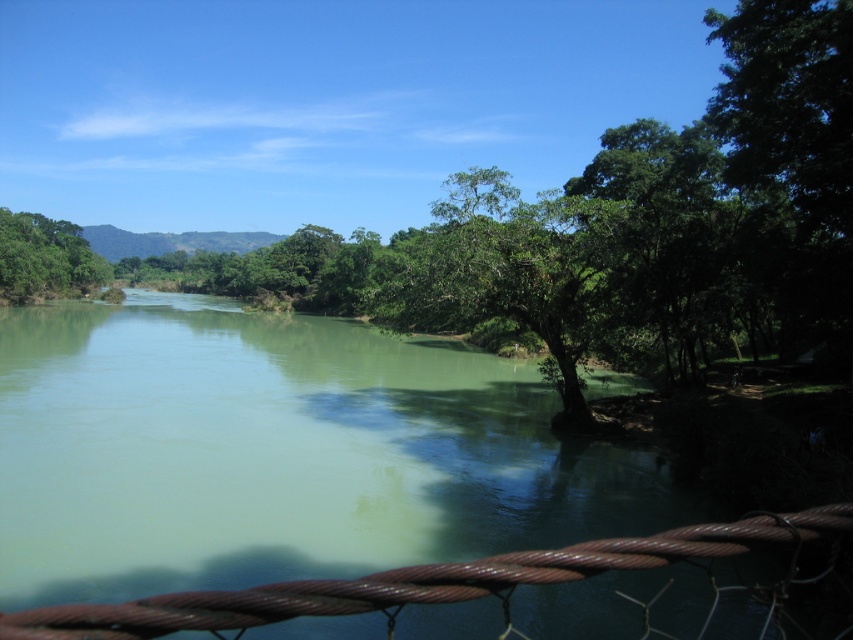
You are a hiker standing at the riverside. You notice a green leafy tree at center and a rusty wire rope at lower center. Which object is taller?

The green leafy tree at center is taller than the rusty wire rope at lower center according to the description.

You are standing at the center of the image and want to locate the green leafy tree at center. What are the coordinates where you should look?

The coordinates to locate the green leafy tree at center are at point (x=509, y=273).

You are standing at the riverside and notice the rusty wire rope at lower center. According to the coordinates provided, is the rope closer to the riverbank or the center of the river?

The rusty wire rope at lower center is located at point coordinates, so it is closer to the riverbank than the center of the river.